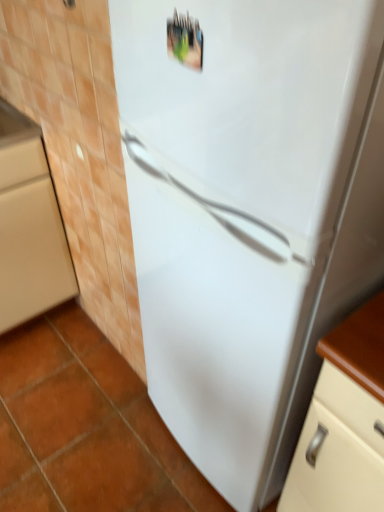
Question: Is white glossy refrigerator at center behind matte wood cabinet at lower left?

Choices:
 (A) no
 (B) yes

Answer: (A)

Question: From the image's perspective, does white glossy refrigerator at center appear lower than matte wood cabinet at lower left?

Choices:
 (A) yes
 (B) no

Answer: (A)

Question: Would you say white glossy refrigerator at center is a long distance from matte wood cabinet at lower left?

Choices:
 (A) no
 (B) yes

Answer: (A)

Question: From the image's perspective, does white glossy refrigerator at center appear higher than matte wood cabinet at lower left?

Choices:
 (A) no
 (B) yes

Answer: (A)

Question: From a real-world perspective, is white glossy refrigerator at center on top of matte wood cabinet at lower left?

Choices:
 (A) no
 (B) yes

Answer: (B)

Question: Is white glossy refrigerator at center completely or partially outside of matte wood cabinet at lower left?

Choices:
 (A) no
 (B) yes

Answer: (B)

Question: Is matte wood cabinet at lower left bigger than white glossy refrigerator at center?

Choices:
 (A) yes
 (B) no

Answer: (B)

Question: From a real-world perspective, is matte wood cabinet at lower left located beneath white glossy refrigerator at center?

Choices:
 (A) no
 (B) yes

Answer: (B)

Question: Does matte wood cabinet at lower left contain white glossy refrigerator at center?

Choices:
 (A) yes
 (B) no

Answer: (B)

Question: Is matte wood cabinet at lower left facing towards white glossy refrigerator at center?

Choices:
 (A) yes
 (B) no

Answer: (B)

Question: From the image's perspective, is matte wood cabinet at lower left below white glossy refrigerator at center?

Choices:
 (A) yes
 (B) no

Answer: (B)

Question: Is matte wood cabinet at lower left located outside white glossy refrigerator at center?

Choices:
 (A) no
 (B) yes

Answer: (B)

Question: In the image, is matte wood cabinet at lower left positioned in front of or behind white glossy refrigerator at center?

Choices:
 (A) front
 (B) behind

Answer: (B)